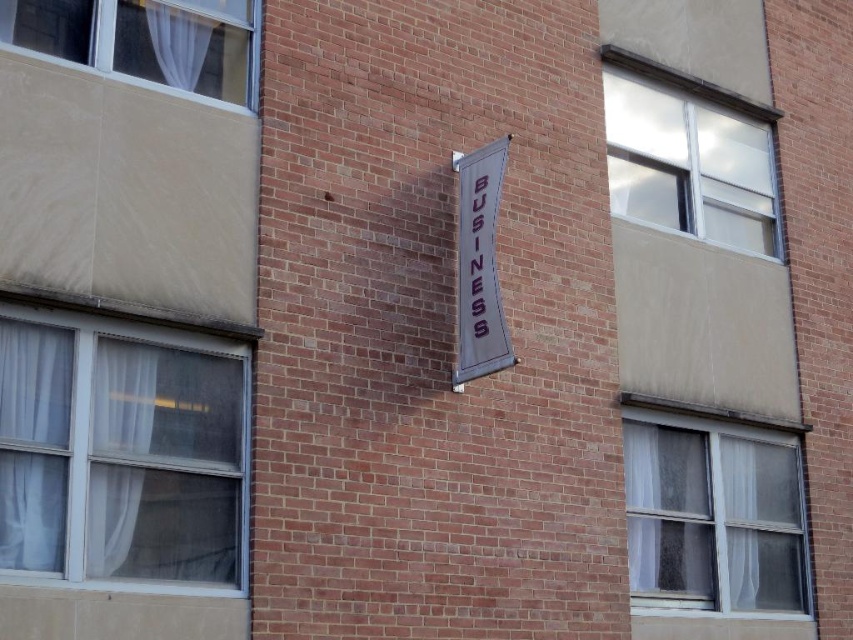
Question: Which object appears farthest from the camera in this image?

Choices:
 (A) white sheer curtain at left
 (B) white sheer fabric at lower right
 (C) white fabric sign at center
 (D) white fabric curtain at upper left

Answer: (B)

Question: Does white sheer curtain at left lie behind white sheer fabric at lower right?

Choices:
 (A) yes
 (B) no

Answer: (B)

Question: Which point appears farthest from the camera in this image?

Choices:
 (A) pyautogui.click(x=608, y=161)
 (B) pyautogui.click(x=457, y=300)

Answer: (A)

Question: Is clear glass window at upper right in front of white fabric curtain at upper left?

Choices:
 (A) yes
 (B) no

Answer: (B)

Question: Which point is farther from the camera taking this photo?

Choices:
 (A) (477, 250)
 (B) (33, 312)

Answer: (A)

Question: Can you confirm if white sheer curtain at left is wider than white fabric curtain at upper left?

Choices:
 (A) no
 (B) yes

Answer: (A)